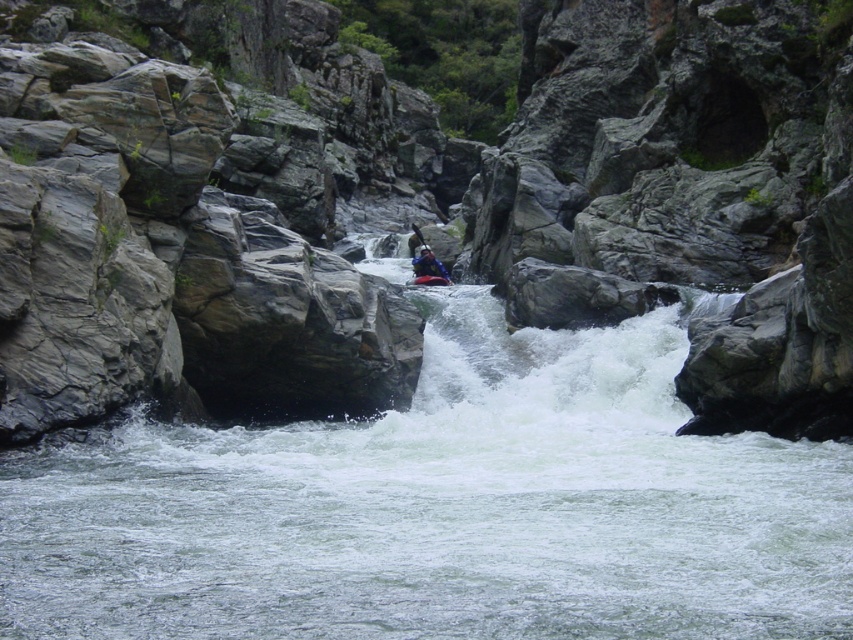
Is gray rock formation at center positioned at the back of white frothy water at center?

Yes, it is.

Who is more distant from viewer, (x=630, y=218) or (x=415, y=524)?

The point (x=630, y=218) is more distant.

Find the location of a particular element. The width and height of the screenshot is (853, 640). gray rock formation at center is located at coordinates (418, 204).

Based on the photo, measure the distance between blue fabric raft at center and red plastic canoe at center.

5.14 meters

Can you confirm if blue fabric raft at center is wider than red plastic canoe at center?

Yes, blue fabric raft at center is wider than red plastic canoe at center.

Is point (425, 262) closer to camera compared to point (434, 282)?

That is False.

Find the location of a particular element. The image size is (853, 640). blue fabric raft at center is located at coordinates (428, 268).

Is red plastic canoe at center to the left of dark blue plastic paddle at center from the viewer's perspective?

No, red plastic canoe at center is not to the left of dark blue plastic paddle at center.

Which is more to the left, red plastic canoe at center or dark blue plastic paddle at center?

dark blue plastic paddle at center is more to the left.

Does point (450, 282) lie behind point (416, 225)?

No, it is in front of (416, 225).

The width and height of the screenshot is (853, 640). In order to click on red plastic canoe at center in this screenshot , I will do `click(431, 280)`.